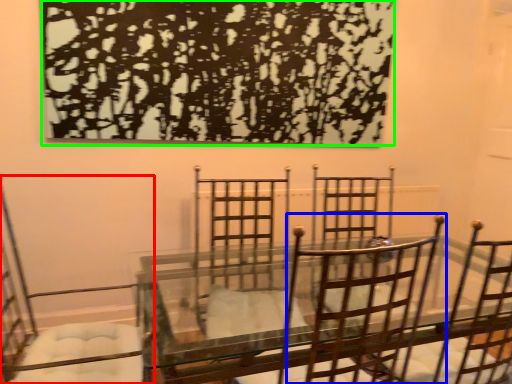
Question: Which object is the closest to the chair (highlighted by a red box)? Choose among these: chair (highlighted by a blue box) or tree (highlighted by a green box).

Choices:
 (A) chair
 (B) tree

Answer: (B)